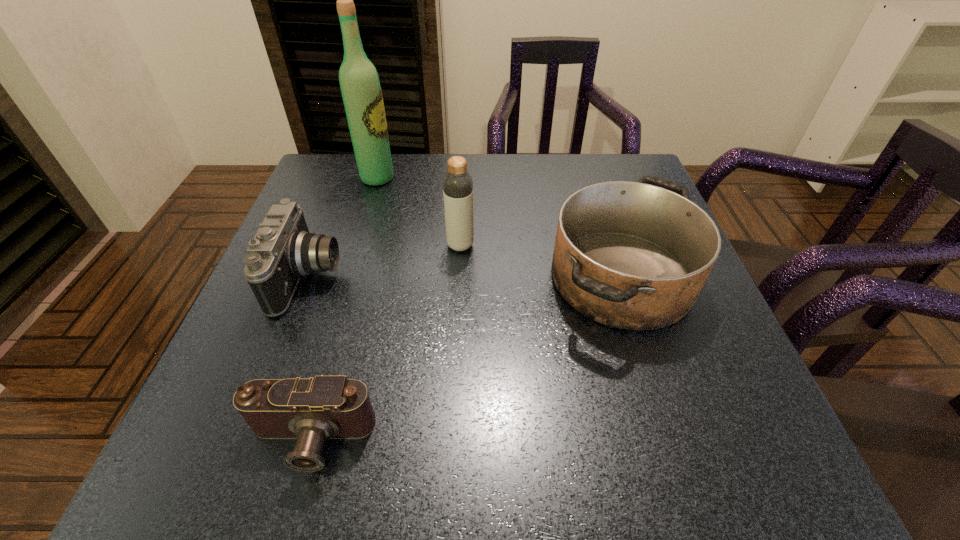
Image resolution: width=960 pixels, height=540 pixels. What are the coordinates of `free space at the left edge of the desktop` in the screenshot? It's located at (257, 358).

Where is `free spot at the right edge of the desktop`? free spot at the right edge of the desktop is located at coordinates (662, 422).

The width and height of the screenshot is (960, 540). What are the coordinates of `vacant space at the far left corner of the desktop` in the screenshot? It's located at (352, 202).

I want to click on unoccupied area between the nearest object and the second tallest object, so click(x=385, y=343).

This screenshot has width=960, height=540. I want to click on empty location between the taller camera and the saucepan, so click(x=466, y=277).

You are a GUI agent. You are given a task and a screenshot of the screen. Output one action in this format:
    pyautogui.click(x=<x>, y=<y>)
    Task: Click on the vacant space that's between the rightmost object and the fourth object from left to right
    Image resolution: width=960 pixels, height=540 pixels.
    Given the screenshot: What is the action you would take?
    pyautogui.click(x=540, y=261)

In order to click on vacant area between the shortest object and the farther camera in this screenshot , I will do `click(310, 359)`.

Where is `vacant area that lies between the shortest object and the bottle`? vacant area that lies between the shortest object and the bottle is located at coordinates (385, 343).

Locate an element on the screen. Image resolution: width=960 pixels, height=540 pixels. vacant area between the rightmost object and the nearest object is located at coordinates (466, 359).

Identify the location of vacant space that is in between the second tallest object and the nearer camera. (385, 343).